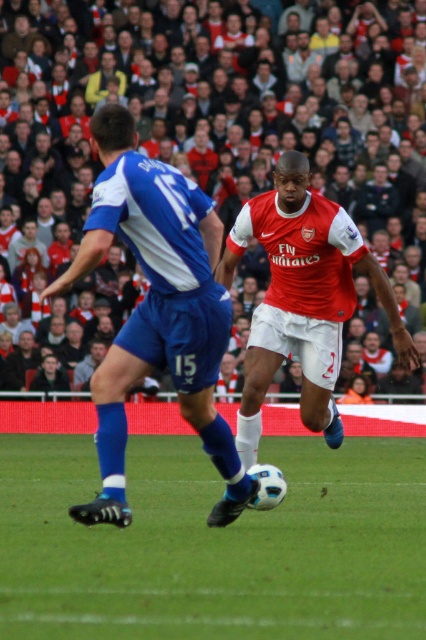
Which is below, red fabric crowd at upper center or blue fabric shorts at left?

blue fabric shorts at left is lower down.

Who is taller, red fabric crowd at upper center or blue fabric shorts at left?

Standing taller between the two is red fabric crowd at upper center.

Is point (60, 72) positioned in front of point (163, 269)?

No.

Locate an element on the screen. The height and width of the screenshot is (640, 426). red fabric crowd at upper center is located at coordinates (219, 84).

Can you confirm if green grass at center is wider than blue fabric shorts at left?

Yes.

Between green grass at center and blue fabric shorts at left, which one has more height?

With more height is blue fabric shorts at left.

Where is `green grass at center`? The width and height of the screenshot is (426, 640). green grass at center is located at coordinates (215, 545).

Image resolution: width=426 pixels, height=640 pixels. Identify the location of green grass at center. (215, 545).

Can you confirm if green grass at center is wider than red fabric crowd at upper center?

Incorrect, green grass at center's width does not surpass red fabric crowd at upper center's.

Is green grass at center smaller than red fabric crowd at upper center?

Correct, green grass at center occupies less space than red fabric crowd at upper center.

The width and height of the screenshot is (426, 640). What do you see at coordinates (215, 545) in the screenshot?
I see `green grass at center` at bounding box center [215, 545].

Where is `green grass at center`? This screenshot has width=426, height=640. green grass at center is located at coordinates (215, 545).